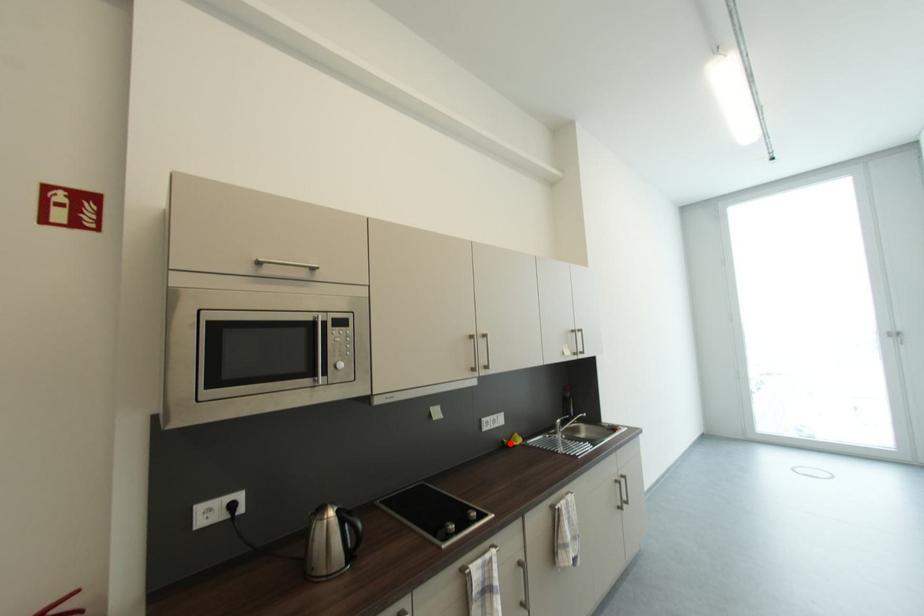
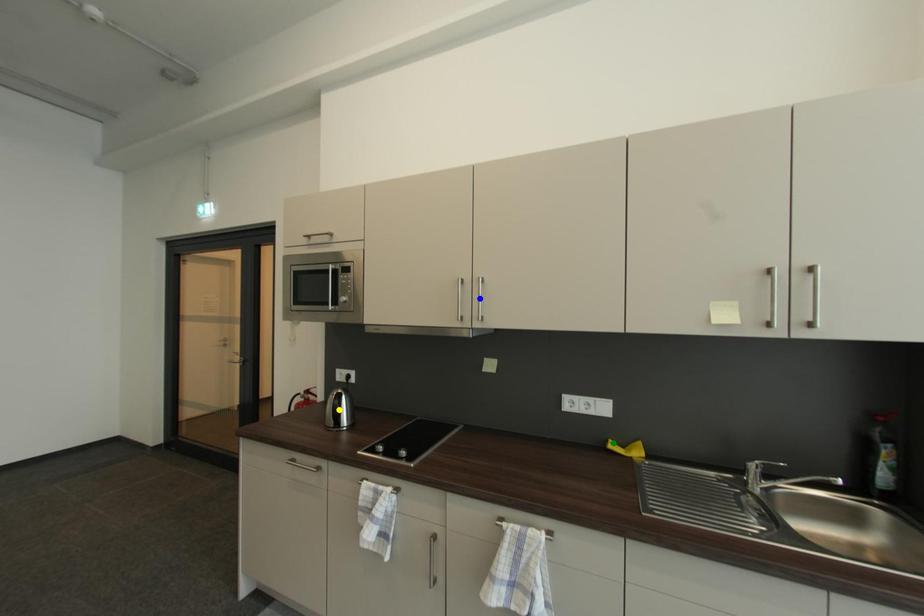
Question: I am providing you with two images of the same scene from different viewpoints. A red point is marked on the first image. You are given multiple points on the second image. Which spot in image 2 lines up with the point in image 1?

Choices:
 (A) green point
 (B) yellow point
 (C) blue point

Answer: (A)